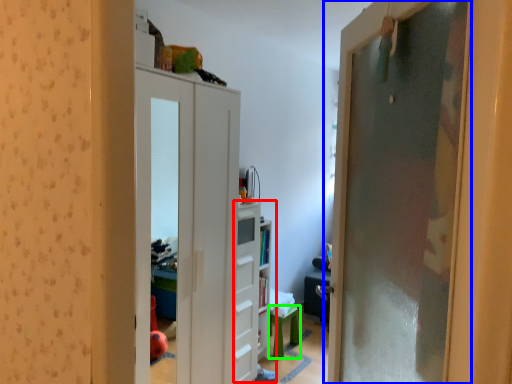
Question: Which is farther away from dresser (highlighted by a red box)? door (highlighted by a blue box) or furniture (highlighted by a green box)?

Choices:
 (A) door
 (B) furniture

Answer: (A)